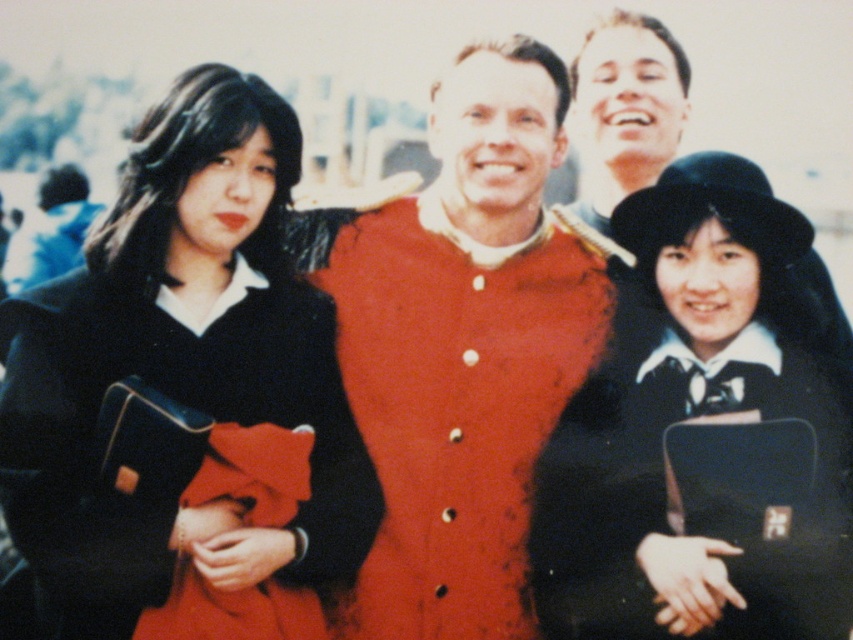
Question: Is black matte hat at upper right bigger than matte red coat at center?

Choices:
 (A) yes
 (B) no

Answer: (B)

Question: Which of these objects is positioned closest to the red leather jacket at center?

Choices:
 (A) matte red coat at center
 (B) black matte jacket at left

Answer: (B)

Question: Considering the real-world distances, which object is closest to the red leather jacket at center?

Choices:
 (A) black matte hat at upper right
 (B) matte red coat at center
 (C) black matte jacket at left

Answer: (C)

Question: Which object is closer to the camera taking this photo?

Choices:
 (A) matte red coat at center
 (B) black matte jacket at left
 (C) red leather jacket at center

Answer: (B)

Question: Does black matte jacket at left have a greater width compared to matte red coat at center?

Choices:
 (A) yes
 (B) no

Answer: (A)

Question: Can you confirm if black matte jacket at left is thinner than red wool coat at center?

Choices:
 (A) no
 (B) yes

Answer: (B)